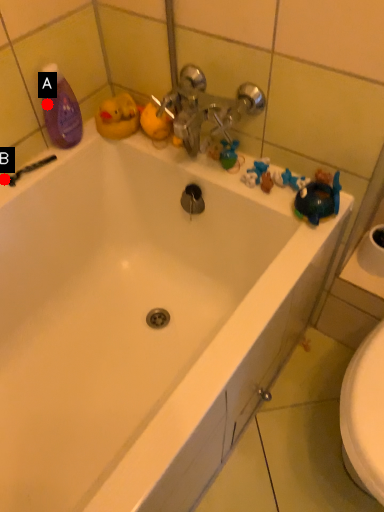
Question: Two points are circled on the image, labeled by A and B beside each circle. Which point is closer to the camera?

Choices:
 (A) A is closer
 (B) B is closer

Answer: (B)